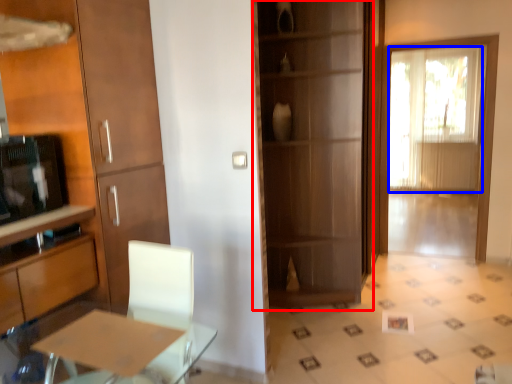
Question: Which object is closer to the camera taking this photo, cupboard (highlighted by a red box) or window screen (highlighted by a blue box)?

Choices:
 (A) cupboard
 (B) window screen

Answer: (A)